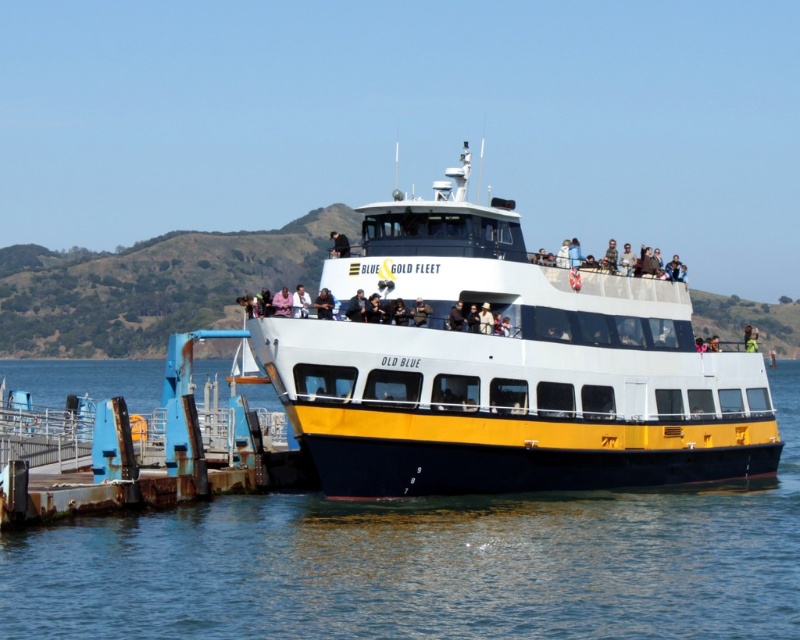
You are a photographer trying to capture the entire ferry and the person in the matte black jacket in one shot. Given that the camera can only focus on objects within a 10 meter width, can you fit both the yellow matte ferry at center and the matte black jacket at upper center into the frame without cropping?

The yellow matte ferry at center is wider than the matte black jacket at upper center. Since the camera can focus on objects within a 10 meter width, and the ferry is wider than the jacket, you can fit both into the frame as long as their combined width does not exceed 10 meters. However, the exact feasibility depends on the actual dimensions of the ferry and jacket, which are not provided here.

You are standing on the ferry named Old Blue and looking towards the pier. Where is the blue water at lower left located relative to your position?

The blue water at lower left is located at the coordinates point [428,564] relative to your position on the ferry.